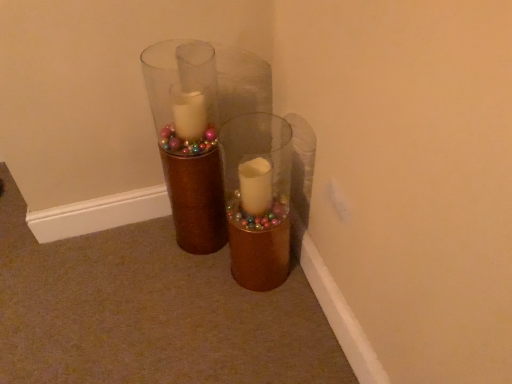
Question: Should I look upward or downward to see gold glitter vase at center, which is the 2th vase in right-to-left order?

Choices:
 (A) down
 (B) up

Answer: (B)

Question: Could you tell me if brown textured vase at center, the first vase when ordered from right to left, is turned towards gold glitter vase at center, which is the 2th vase in right-to-left order?

Choices:
 (A) yes
 (B) no

Answer: (B)

Question: Is brown textured vase at center, the first vase when ordered from right to left, placed right next to gold glitter vase at center, which is the 2th vase in right-to-left order?

Choices:
 (A) yes
 (B) no

Answer: (B)

Question: Does brown textured vase at center, the first vase when ordered from right to left, appear on the left side of gold glitter vase at center, which is the 2th vase in right-to-left order?

Choices:
 (A) yes
 (B) no

Answer: (B)

Question: Can you confirm if brown textured vase at center, the first vase when ordered from right to left, is positioned to the right of gold glitter vase at center, acting as the 1th vase starting from the left?

Choices:
 (A) no
 (B) yes

Answer: (B)

Question: Considering the relative sizes of brown textured vase at center, the first vase when ordered from right to left, and gold glitter vase at center, acting as the 1th vase starting from the left, in the image provided, is brown textured vase at center, the first vase when ordered from right to left, thinner than gold glitter vase at center, acting as the 1th vase starting from the left,?

Choices:
 (A) no
 (B) yes

Answer: (B)

Question: Is brown textured vase at center, the first vase when ordered from right to left, further to camera compared to gold glitter vase at center, acting as the 1th vase starting from the left?

Choices:
 (A) no
 (B) yes

Answer: (A)

Question: Can you confirm if gold glitter vase at center, acting as the 1th vase starting from the left, is thinner than brown textured vase at center, which is counted as the 2th vase, starting from the left?

Choices:
 (A) no
 (B) yes

Answer: (A)

Question: Does gold glitter vase at center, acting as the 1th vase starting from the left, touch brown textured vase at center, which is counted as the 2th vase, starting from the left?

Choices:
 (A) yes
 (B) no

Answer: (B)

Question: Does gold glitter vase at center, acting as the 1th vase starting from the left, have a smaller size compared to brown textured vase at center, the first vase when ordered from right to left?

Choices:
 (A) no
 (B) yes

Answer: (A)

Question: Is gold glitter vase at center, which is the 2th vase in right-to-left order, wider than brown textured vase at center, which is counted as the 2th vase, starting from the left?

Choices:
 (A) yes
 (B) no

Answer: (A)

Question: Is gold glitter vase at center, which is the 2th vase in right-to-left order, facing away from brown textured vase at center, the first vase when ordered from right to left?

Choices:
 (A) yes
 (B) no

Answer: (B)

Question: From a real-world perspective, is gold glitter vase at center, which is the 2th vase in right-to-left order, over brown textured vase at center, the first vase when ordered from right to left?

Choices:
 (A) yes
 (B) no

Answer: (A)

Question: Considering the positions of point (219, 163) and point (240, 216), is point (219, 163) closer or farther from the camera than point (240, 216)?

Choices:
 (A) farther
 (B) closer

Answer: (A)